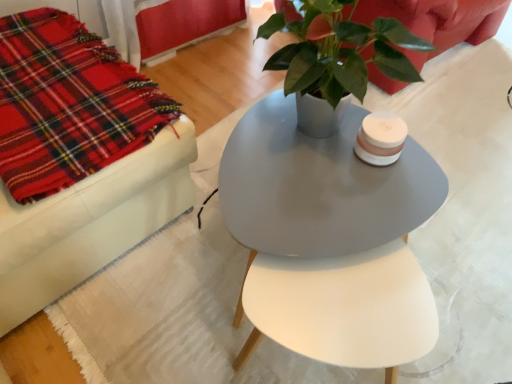
You are a GUI agent. You are given a task and a screenshot of the screen. Output one action in this format:
    pyautogui.click(x=<x>, y=<y>)
    Task: Click on the matte red couch at upper left
    The height and width of the screenshot is (384, 512).
    Given the screenshot: What is the action you would take?
    pyautogui.click(x=438, y=21)

From a real-world perspective, which object rests below the other?

matte gray table at center, from a real-world perspective.

Does red plaid fabric at left have a larger size compared to matte gray table at center?

No, red plaid fabric at left is not bigger than matte gray table at center.

Is red plaid fabric at left wider than matte gray table at center?

In fact, red plaid fabric at left might be narrower than matte gray table at center.

Is point (0, 37) closer or farther from the camera than point (253, 132)?

Point (0, 37) appears to be farther away from the viewer than point (253, 132).

Is matte gray table at center at the right side of red plaid fabric at left?

Correct, you'll find matte gray table at center to the right of red plaid fabric at left.

Looking at this image, is matte gray table at center oriented towards red plaid fabric at left?

No, matte gray table at center is not aimed at red plaid fabric at left.

Considering the points (340, 271) and (176, 109), which point is in front, point (340, 271) or point (176, 109)?

The point (340, 271) is in front.

Do you think matte gray table at center is within red plaid fabric at left, or outside of it?

matte gray table at center lies outside red plaid fabric at left.

Based on the photo, measure the distance between matte red couch at upper left and red plaid fabric at left.

The distance of matte red couch at upper left from red plaid fabric at left is 28.52 inches.

Is point (402, 7) positioned in front of point (69, 99)?

No.

Could you tell me if matte red couch at upper left is facing red plaid fabric at left?

No, matte red couch at upper left is not oriented towards red plaid fabric at left.

From the picture: Can you tell me how much matte red couch at upper left and red plaid fabric at left differ in facing direction?

Answer: matte red couch at upper left and red plaid fabric at left are facing 95.7 degrees away from each other.

Looking at this image, is matte red couch at upper left inside or outside of matte gray table at center?

matte red couch at upper left lies outside matte gray table at center.

Between matte red couch at upper left and matte gray table at center, which one appears on the right side from the viewer's perspective?

matte red couch at upper left.

From a real-world perspective, relative to matte gray table at center, is matte red couch at upper left vertically above or below?

A: From a real-world perspective, matte red couch at upper left is physically above matte gray table at center.

Which is farther, (460, 36) or (307, 148)?

Point (460, 36)

Between point (106, 121) and point (277, 2), which one is positioned in front?

The point (277, 2) is closer to the camera.

Which of these two, red plaid fabric at left or matte red couch at upper left, stands taller?

matte red couch at upper left is taller.

From the image's perspective, is red plaid fabric at left above or below matte red couch at upper left?

Clearly, from the image's perspective, red plaid fabric at left is below matte red couch at upper left.

Looking at this image, from a real-world perspective, which is physically below, red plaid fabric at left or matte red couch at upper left?

matte red couch at upper left, from a real-world perspective.

Which is more to the right, matte gray table at center or matte red couch at upper left?

matte red couch at upper left.

Can you tell me how much matte gray table at center and matte red couch at upper left differ in facing direction?

matte gray table at center and matte red couch at upper left are facing 92 degrees away from each other.

How distant is matte gray table at center from matte red couch at upper left?

matte gray table at center and matte red couch at upper left are 16.79 inches apart.

Considering the relative sizes of matte gray table at center and matte red couch at upper left in the image provided, is matte gray table at center shorter than matte red couch at upper left?

Correct, matte gray table at center is not as tall as matte red couch at upper left.

Find the location of a particular element. cloth above the matte gray table at center (from a real-world perspective) is located at coordinates (68, 104).

Locate an element on the screen. This screenshot has height=384, width=512. table that is below the red plaid fabric at left (from the image's perspective) is located at coordinates (328, 240).

Which object lies further to the anchor point matte red couch at upper left, red plaid fabric at left or matte gray table at center?

red plaid fabric at left.

Based on their spatial positions, is red plaid fabric at left or matte red couch at upper left closer to matte gray table at center?

The object closer to matte gray table at center is matte red couch at upper left.

Based on their spatial positions, is matte gray table at center or red plaid fabric at left closer to matte red couch at upper left?

matte gray table at center.

Based on their spatial positions, is matte gray table at center or matte red couch at upper left further from red plaid fabric at left?

matte red couch at upper left is further to red plaid fabric at left.

Estimate the real-world distances between objects in this image. Which object is closer to red plaid fabric at left, matte red couch at upper left or matte gray table at center?

matte gray table at center lies closer to red plaid fabric at left than the other object.

From the image, which object appears to be farther from matte gray table at center, matte red couch at upper left or red plaid fabric at left?

The object further to matte gray table at center is red plaid fabric at left.

This screenshot has height=384, width=512. What are the coordinates of `table located between red plaid fabric at left and matte red couch at upper left in the left-right direction` in the screenshot? It's located at (328, 240).